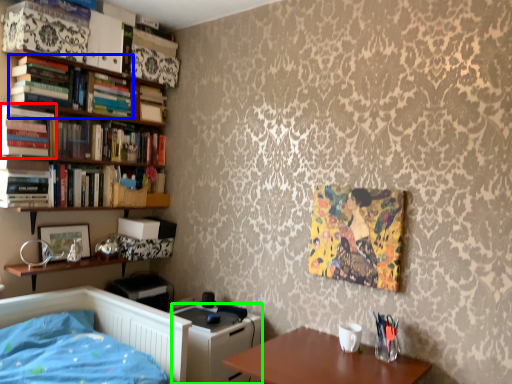
Question: Based on their relative distances, which object is nearer to book (highlighted by a red box)? Choose from book (highlighted by a blue box) and file cabinet (highlighted by a green box).

Choices:
 (A) book
 (B) file cabinet

Answer: (A)